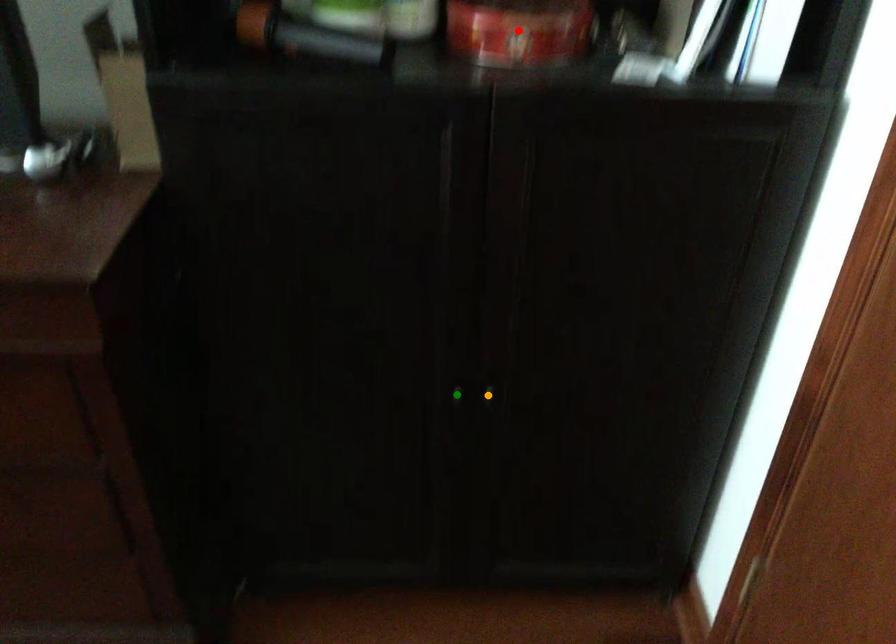
Order these from nearest to farthest:
orange point
red point
green point

orange point → green point → red point